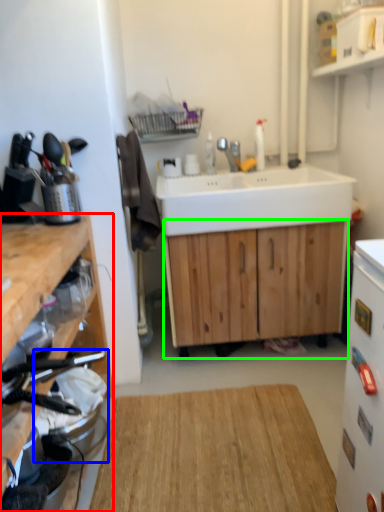
Question: Which object is positioned closest to cabinetry (highlighted by a red box)? Select from appliance (highlighted by a blue box) and cabinetry (highlighted by a green box).

Choices:
 (A) appliance
 (B) cabinetry

Answer: (A)